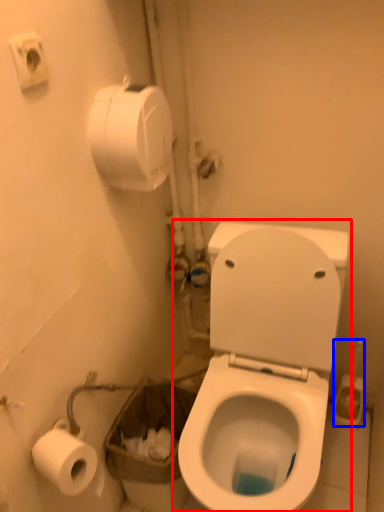
Question: Which of the following is the farthest to the observer, toilet (highlighted by a red box) or brush (highlighted by a blue box)?

Choices:
 (A) toilet
 (B) brush

Answer: (B)